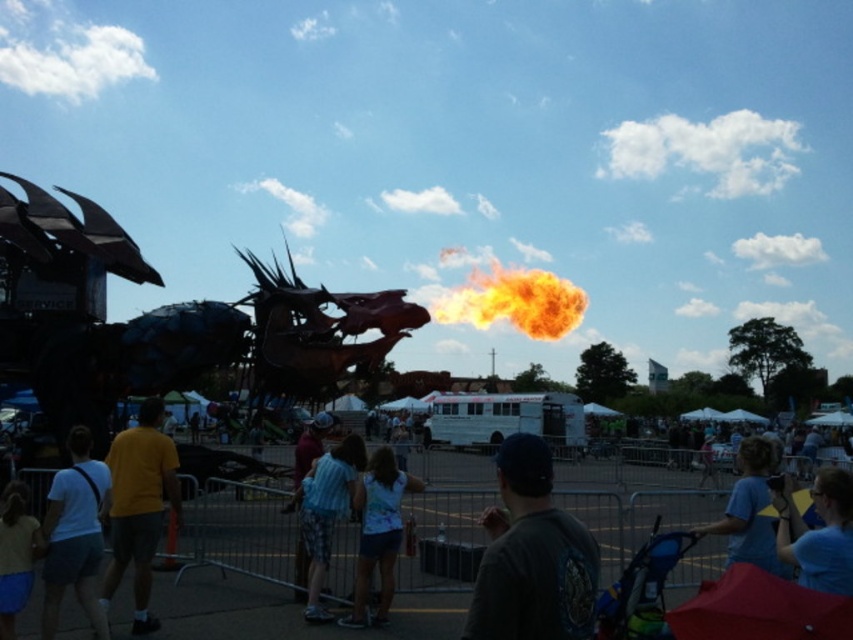
Does blue shirt at center have a lesser width compared to blue cotton shirt at center?

Correct, blue shirt at center's width is less than blue cotton shirt at center's.

Is blue shirt at center further to camera compared to blue cotton shirt at center?

No, blue shirt at center is in front of blue cotton shirt at center.

Does point (840, 550) come behind point (698, 532)?

No.

Where is `blue shirt at center`? The image size is (853, 640). blue shirt at center is located at coordinates (817, 532).

How far apart are white cotton shirt at lower left and white cotton shirt at center?

white cotton shirt at lower left is 19.25 meters away from white cotton shirt at center.

Which is in front, point (61, 468) or point (361, 536)?

Point (361, 536) is more forward.

Is point (86, 563) positioned behind point (410, 490)?

No, (86, 563) is in front of (410, 490).

Find the location of a particular element. The height and width of the screenshot is (640, 853). white cotton shirt at lower left is located at coordinates (74, 534).

Can you confirm if white cotton shirt at lower left is positioned to the right of blue shirt at center?

No, white cotton shirt at lower left is not to the right of blue shirt at center.

Between white cotton shirt at lower left and blue shirt at center, which one has more height?

white cotton shirt at lower left is taller.

Where is `white cotton shirt at lower left`? The width and height of the screenshot is (853, 640). white cotton shirt at lower left is located at coordinates (74, 534).

Locate an element on the screen. This screenshot has height=640, width=853. white cotton shirt at lower left is located at coordinates (74, 534).